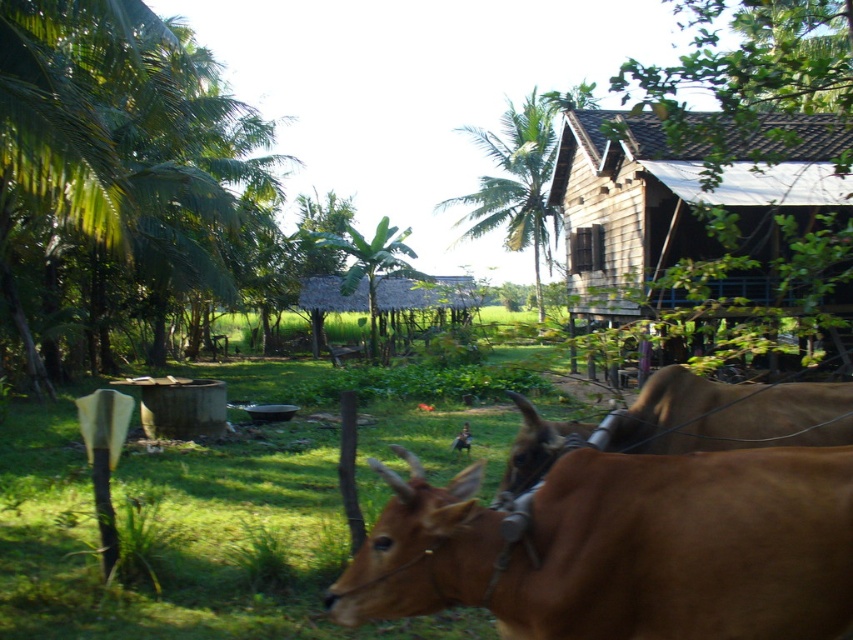
Question: Which object is the closest to the green grass at center?

Choices:
 (A) green leafy palm tree at center
 (B) brown glossy bull at center
 (C) green leafy palm tree at left
 (D) brown smooth cow at lower right

Answer: (C)

Question: Is brown glossy bull at center smaller than thatched straw hut at center?

Choices:
 (A) yes
 (B) no

Answer: (A)

Question: Which object is farther from the camera taking this photo?

Choices:
 (A) green grass at center
 (B) green leafy palm tree at upper center

Answer: (B)

Question: From the image, what is the correct spatial relationship of green leafy palm tree at left in relation to green grass at center?

Choices:
 (A) left
 (B) right

Answer: (A)

Question: Is green leafy palm tree at upper center in front of green leafy palm tree at center?

Choices:
 (A) yes
 (B) no

Answer: (A)

Question: Which point is closer to the camera?

Choices:
 (A) brown glossy bull at center
 (B) green leafy palm tree at upper center

Answer: (A)